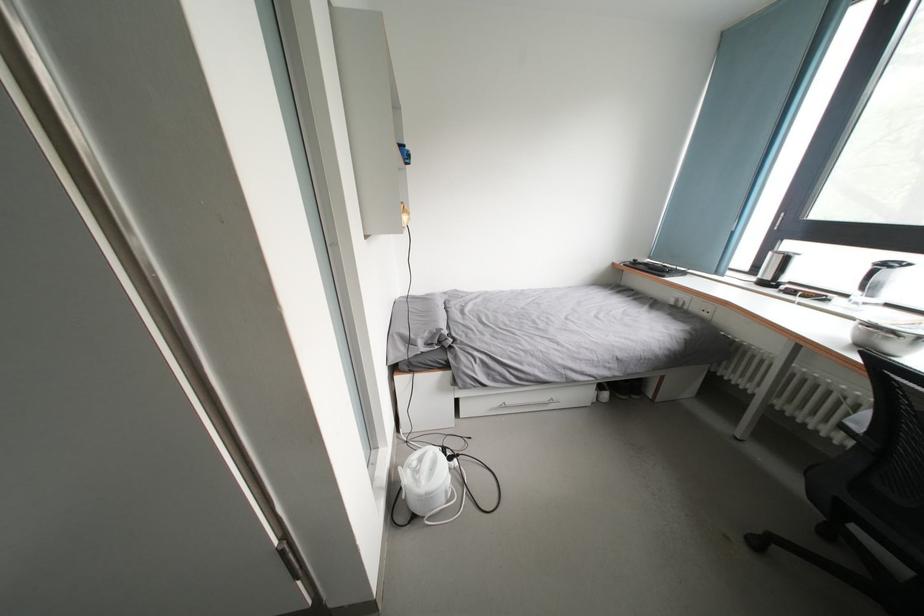
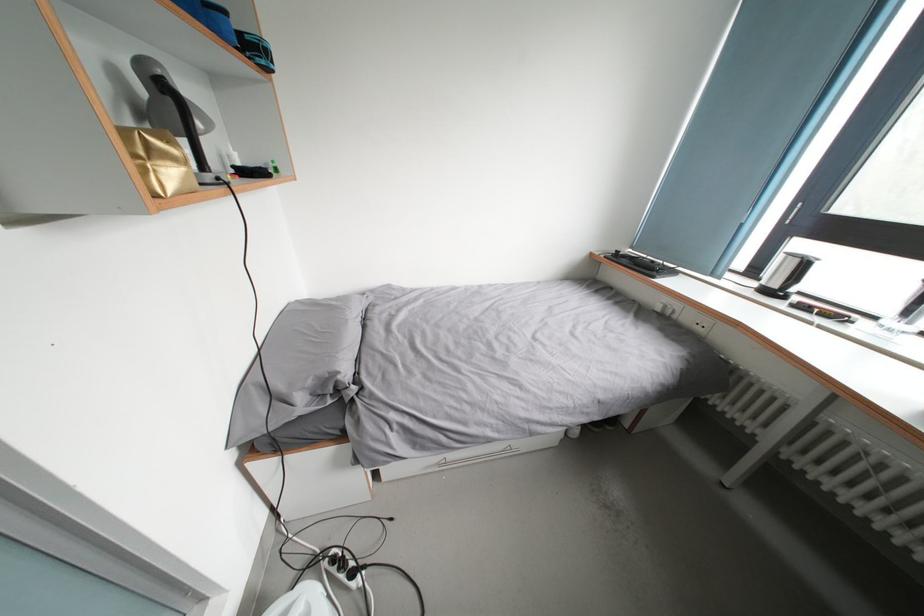
The images are taken continuously from a first-person perspective. In which direction are you moving?

The cameraman moved toward right, forward.